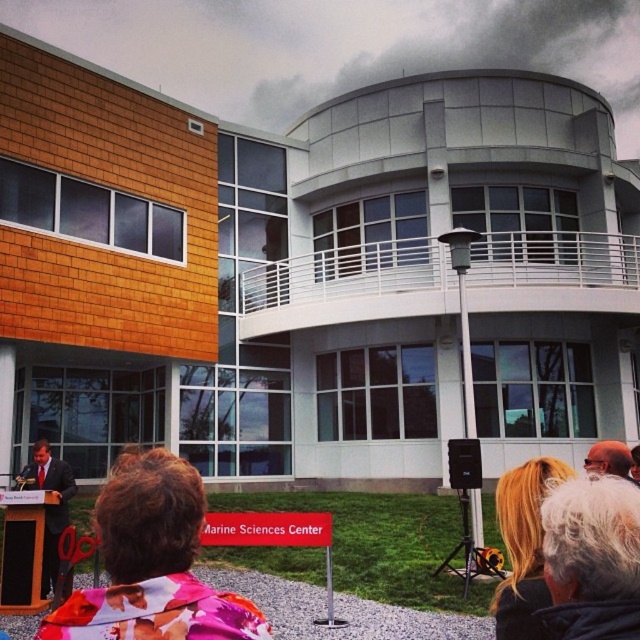
You are a photographer trying to capture a clear shot of the floral fabric jacket at lower center and the blonde hair at upper right. Since you want both subjects to be in focus, which one should you adjust your camera focus on first, considering their relative sizes in the frame?

The floral fabric jacket at lower center has a greater height compared to the blonde hair at upper right, so you should focus on the larger subject first to ensure both are in focus.

You are a photographer at the event and need to capture a photo that includes both the floral fabric jacket at lower center and the blonde hair at upper right. What is the minimum distance you should set your camera lens to ensure both subjects are in focus?

The floral fabric jacket at lower center and the blonde hair at upper right are 2.41 meters apart from each other. To ensure both are in focus, set your camera lens to a focal length that can accommodate a subject distance difference of at least 2.41 meters.